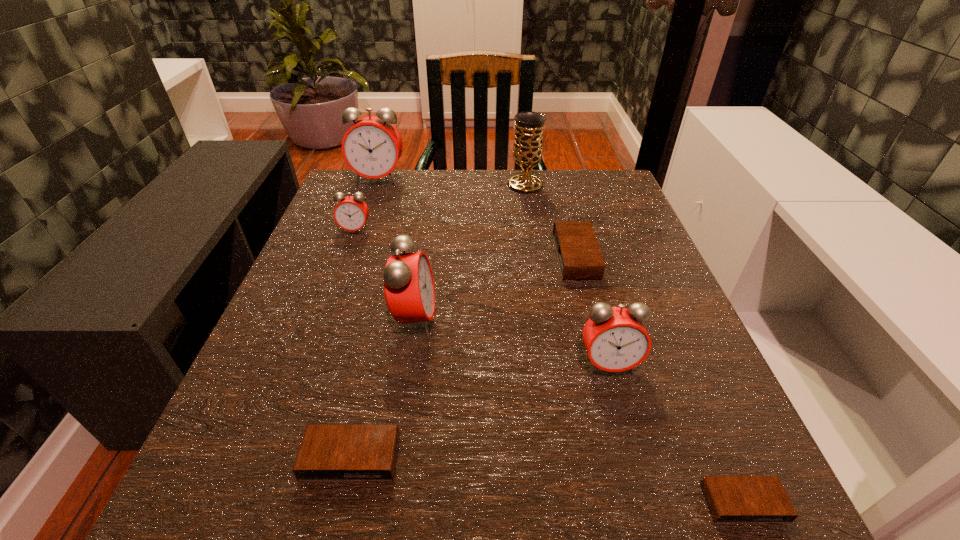
This screenshot has height=540, width=960. I want to click on the farthest alarm clock, so pyautogui.click(x=372, y=147).

The width and height of the screenshot is (960, 540). What are the coordinates of `the biggest red alarm clock` in the screenshot? It's located at (372, 147).

The height and width of the screenshot is (540, 960). What are the coordinates of `chalice` in the screenshot? It's located at (528, 142).

Find the location of a particular element. This screenshot has width=960, height=540. the sixth shortest alarm clock is located at coordinates (409, 289).

Where is `the third farthest red alarm clock`? The width and height of the screenshot is (960, 540). the third farthest red alarm clock is located at coordinates (409, 289).

Image resolution: width=960 pixels, height=540 pixels. Find the location of `the second smallest red alarm clock`. the second smallest red alarm clock is located at coordinates (615, 338).

Where is `the rightmost red alarm clock`? The image size is (960, 540). the rightmost red alarm clock is located at coordinates (615, 338).

At what (x,y) coordinates should I click in order to perform the action: click on the smallest red alarm clock. Please return your answer as a coordinate pair (x, y). Image resolution: width=960 pixels, height=540 pixels. Looking at the image, I should click on (351, 212).

In order to click on the fifth tallest object in this screenshot , I will do `click(351, 212)`.

This screenshot has height=540, width=960. I want to click on the second black alarm clock from left to right, so click(x=579, y=256).